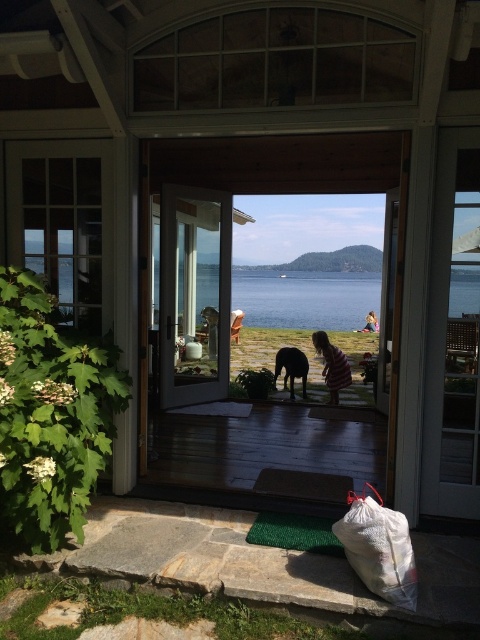
Is point (201, 337) positioned after point (240, 294)?

No.

Between point (187, 241) and point (301, 275), which one is positioned behind?

Positioned behind is point (301, 275).

Where is `clear glass screen door at center`? This screenshot has height=640, width=480. clear glass screen door at center is located at coordinates (193, 294).

Can you confirm if wooden deck at center is positioned above pink striped dress at center?

No, wooden deck at center is not above pink striped dress at center.

Can you confirm if wooden deck at center is bigger than pink striped dress at center?

Yes, wooden deck at center is bigger than pink striped dress at center.

Is point (214, 413) more distant than point (347, 369)?

No, (214, 413) is closer to viewer.

Where is `wooden deck at center`? Image resolution: width=480 pixels, height=640 pixels. wooden deck at center is located at coordinates (268, 448).

Measure the distance between blue water at center and pink striped dress at center.

blue water at center and pink striped dress at center are 5.17 meters apart.

Which is below, blue water at center or pink striped dress at center?

pink striped dress at center is below.

Is point (369, 284) positioned in front of point (313, 346)?

No.

Identify the location of blue water at center. This screenshot has height=640, width=480. (305, 298).